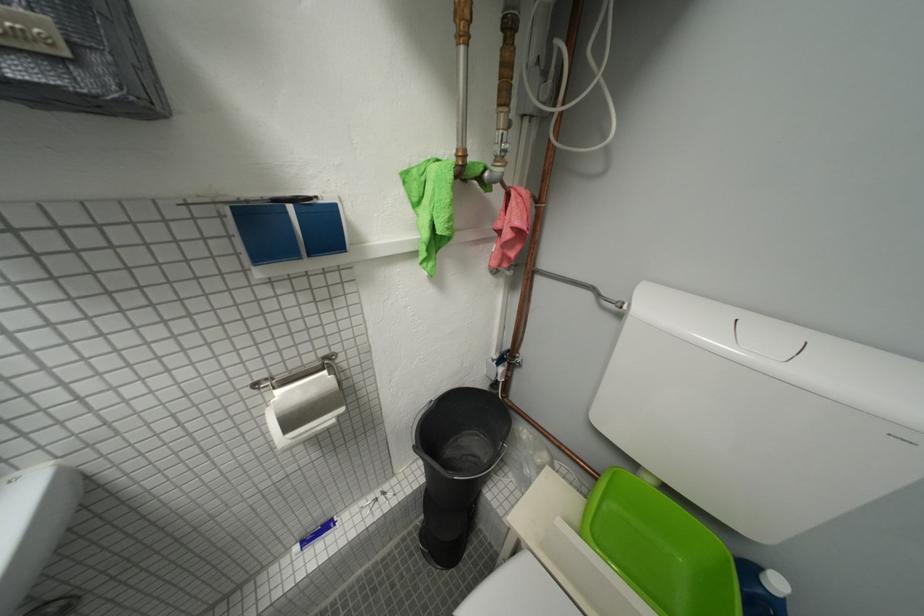
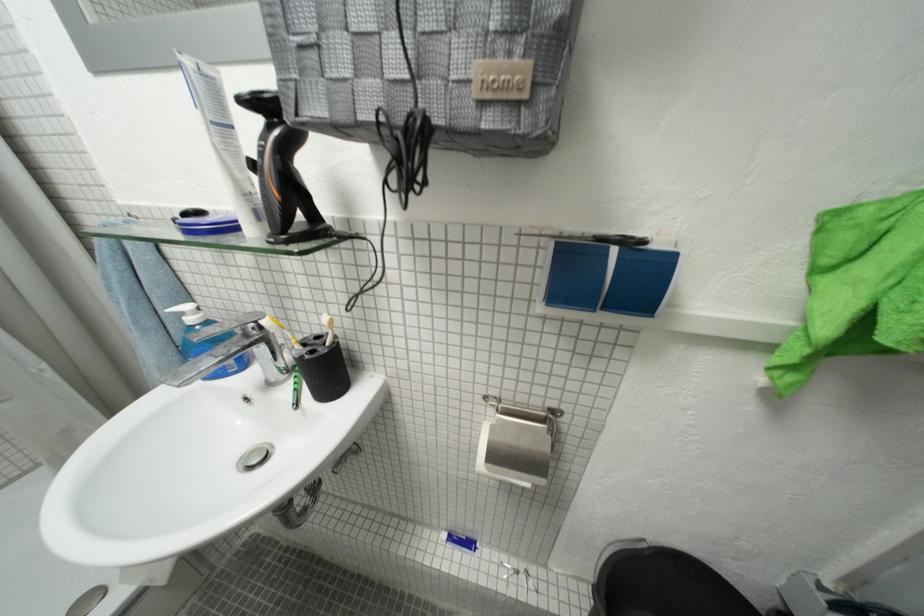
Where in the second image is the point corresponding to the point at 336,423 from the first image?

(533, 483)